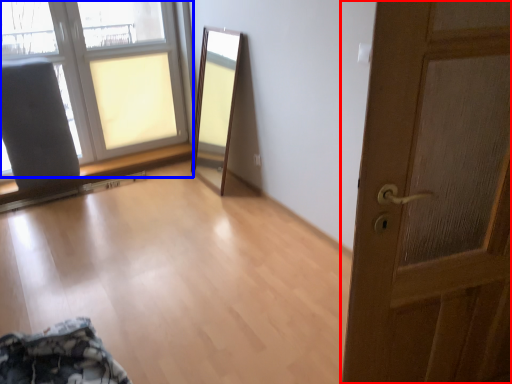
Question: Which object is closer to the camera taking this photo, door (highlighted by a red box) or window (highlighted by a blue box)?

Choices:
 (A) door
 (B) window

Answer: (A)